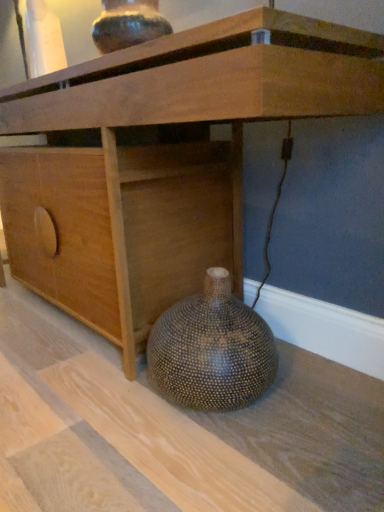
This screenshot has width=384, height=512. I want to click on free location to the left of brown textured vase at lower right, which ranks as the 2th vase in top-to-bottom order, so click(x=102, y=406).